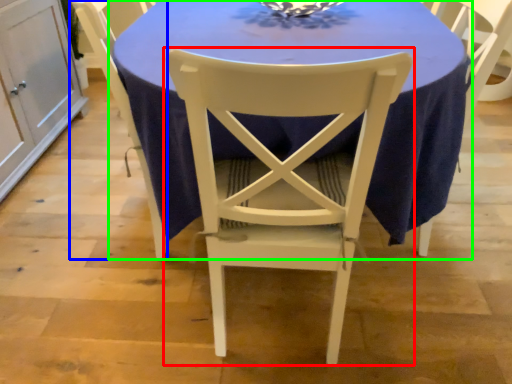
Question: Which object is positioned farthest from chair (highlighted by a red box)? Select from chair (highlighted by a blue box) and table (highlighted by a green box).

Choices:
 (A) chair
 (B) table

Answer: (A)